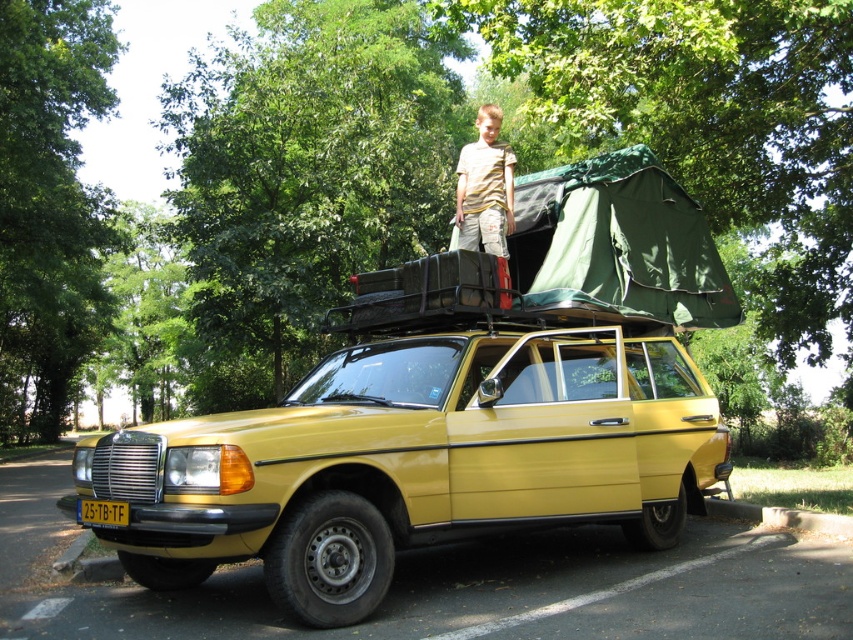
Question: Among these objects, which one is nearest to the camera?

Choices:
 (A) yellow plastic license plate at lower left
 (B) yellow striped shirt at upper center

Answer: (A)

Question: Does yellow matte car at center have a greater width compared to yellow striped shirt at upper center?

Choices:
 (A) no
 (B) yes

Answer: (B)

Question: Which object is closer to the camera taking this photo?

Choices:
 (A) yellow matte car at center
 (B) yellow striped shirt at upper center
 (C) yellow plastic license plate at lower left

Answer: (A)

Question: Is yellow matte car at center wider than yellow plastic license plate at lower left?

Choices:
 (A) no
 (B) yes

Answer: (B)

Question: Which point is farther to the camera?

Choices:
 (A) (509, 166)
 (B) (221, 513)
 (C) (117, 520)

Answer: (A)

Question: Is yellow matte car at center further to camera compared to yellow striped shirt at upper center?

Choices:
 (A) no
 (B) yes

Answer: (A)